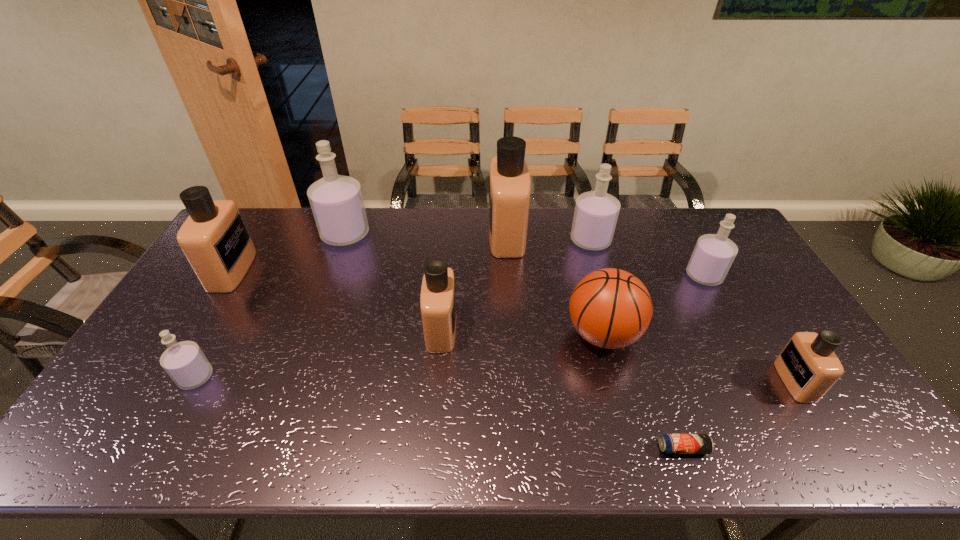
This screenshot has height=540, width=960. In order to click on free space between the third perfume from left to right and the shortest object in this screenshot , I will do `click(515, 341)`.

The width and height of the screenshot is (960, 540). I want to click on vacant area that lies between the basketball and the leftmost purple perfume, so click(x=399, y=356).

This screenshot has height=540, width=960. I want to click on vacant space in between the nearest beige perfume and the leftmost beige perfume, so click(514, 326).

Locate an element on the screen. This screenshot has height=540, width=960. free point between the third purple perfume from left to right and the smallest beige perfume is located at coordinates (692, 311).

Locate an element on the screen. This screenshot has width=960, height=540. vacant space in between the nearest beige perfume and the basketball is located at coordinates (699, 358).

Choose which object is the eighth nearest neighbor to the fourth perfume from right to left. Please provide its 2D coordinates. Your answer should be formatted as a tuple, i.e. [(x, y)], where the tuple contains the x and y coordinates of a point satisfying the conditions above.

[(214, 238)]

You are a GUI agent. You are given a task and a screenshot of the screen. Output one action in this format:
    pyautogui.click(x=<x>, y=<y>)
    Task: Click on the object identified as the fourth closest to the leftmost purple perfume
    This screenshot has height=540, width=960.
    Given the screenshot: What is the action you would take?
    pyautogui.click(x=509, y=180)

Locate an element on the screen. Image resolution: width=960 pixels, height=540 pixels. perfume that is the fifth closest to the rightmost beige perfume is located at coordinates (336, 201).

Point out which perfume is positioned as the second nearest to the third farthest beige perfume. Please provide its 2D coordinates. Your answer should be formatted as a tuple, i.e. [(x, y)], where the tuple contains the x and y coordinates of a point satisfying the conditions above.

[(336, 201)]

Locate which beige perfume ranks third in proximity to the nearest beige perfume. Please provide its 2D coordinates. Your answer should be formatted as a tuple, i.e. [(x, y)], where the tuple contains the x and y coordinates of a point satisfying the conditions above.

[(214, 238)]